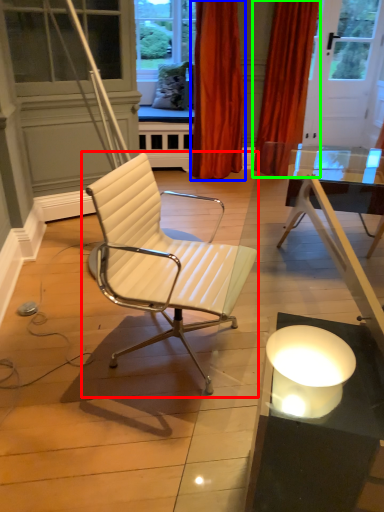
Question: Based on their relative distances, which object is nearer to chair (highlighted by a red box)? Choose from curtain (highlighted by a blue box) and curtain (highlighted by a green box).

Choices:
 (A) curtain
 (B) curtain

Answer: (A)